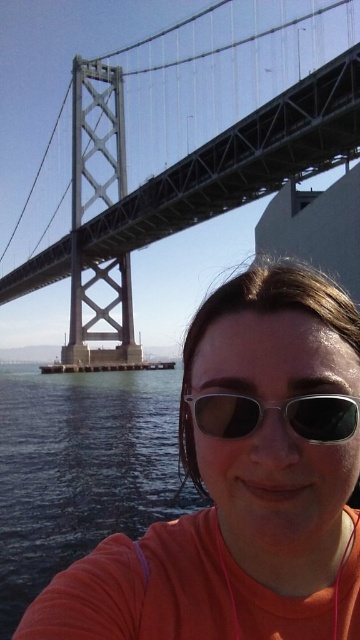
Question: Which object appears closest to the camera in this image?

Choices:
 (A) matte orange shirt at center
 (B) sunglasses at center
 (C) transparent water at lower left
 (D) metallic gray suspension bridge at upper center

Answer: (A)

Question: Can you confirm if matte orange shirt at center is wider than transparent water at lower left?

Choices:
 (A) no
 (B) yes

Answer: (A)

Question: Does metallic gray suspension bridge at upper center have a greater width compared to sunglasses at center?

Choices:
 (A) yes
 (B) no

Answer: (A)

Question: Is transparent water at lower left behind sunglasses at center?

Choices:
 (A) yes
 (B) no

Answer: (A)

Question: Which of the following is the farthest from the observer?

Choices:
 (A) (262, 604)
 (B) (100, 316)
 (C) (289, 397)
 (D) (182, 508)

Answer: (B)

Question: Estimate the real-world distances between objects in this image. Which object is farther from the transparent water at lower left?

Choices:
 (A) sunglasses at center
 (B) matte orange shirt at center

Answer: (A)